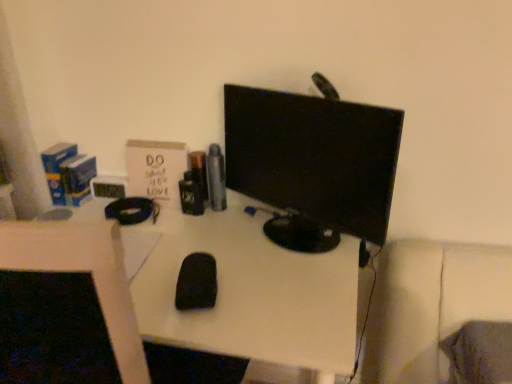
Image resolution: width=512 pixels, height=384 pixels. What are the coordinates of `free space to the left of black matte mouse at center` in the screenshot? It's located at (153, 286).